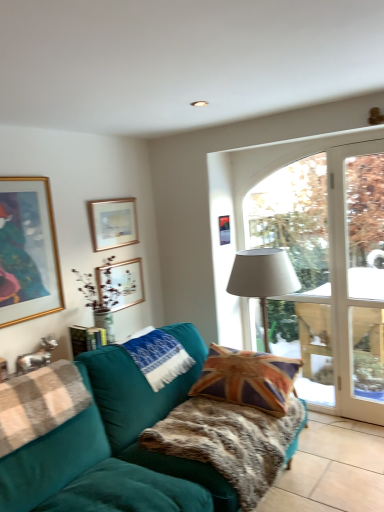
Question: Should I look upward or downward to see matte gold picture frame at upper center, the 3th picture frame positioned from the right?

Choices:
 (A) up
 (B) down

Answer: (A)

Question: Is white fabric lampshade at center thinner than white knitted pillow at center, which appears as the second pillow when viewed from the right?

Choices:
 (A) yes
 (B) no

Answer: (B)

Question: Is white fabric lampshade at center not near white knitted pillow at center, which appears as the second pillow when viewed from the right?

Choices:
 (A) no
 (B) yes

Answer: (A)

Question: From the image's perspective, would you say white fabric lampshade at center is positioned over white knitted pillow at center, which appears as the second pillow when viewed from the right?

Choices:
 (A) no
 (B) yes

Answer: (B)

Question: Does white fabric lampshade at center turn towards white knitted pillow at center, which appears as the second pillow when viewed from the right?

Choices:
 (A) yes
 (B) no

Answer: (B)

Question: Is white fabric lampshade at center next to white knitted pillow at center, which appears as the second pillow when viewed from the right?

Choices:
 (A) no
 (B) yes

Answer: (A)

Question: Is white fabric lampshade at center at the right side of white knitted pillow at center, which appears as the first pillow when viewed from the left?

Choices:
 (A) no
 (B) yes

Answer: (B)

Question: Considering the relative sizes of metallic gold picture frame at upper center, placed as the 1th picture frame when sorted from right to left, and white glass door at right in the image provided, is metallic gold picture frame at upper center, placed as the 1th picture frame when sorted from right to left, bigger than white glass door at right?

Choices:
 (A) no
 (B) yes

Answer: (A)

Question: Is metallic gold picture frame at upper center, acting as the 4th picture frame starting from the left, facing away from white glass door at right?

Choices:
 (A) no
 (B) yes

Answer: (A)

Question: Is metallic gold picture frame at upper center, acting as the 4th picture frame starting from the left, not close to white glass door at right?

Choices:
 (A) yes
 (B) no

Answer: (A)

Question: From a real-world perspective, is metallic gold picture frame at upper center, acting as the 4th picture frame starting from the left, over white glass door at right?

Choices:
 (A) yes
 (B) no

Answer: (A)

Question: Can we say metallic gold picture frame at upper center, acting as the 4th picture frame starting from the left, lies outside white glass door at right?

Choices:
 (A) no
 (B) yes

Answer: (B)

Question: Considering the relative sizes of metallic gold picture frame at upper center, acting as the 4th picture frame starting from the left, and white glass door at right in the image provided, is metallic gold picture frame at upper center, acting as the 4th picture frame starting from the left, smaller than white glass door at right?

Choices:
 (A) yes
 (B) no

Answer: (A)

Question: Would you say white glass door at right is outside white knitted pillow at center, which appears as the first pillow when viewed from the left?

Choices:
 (A) yes
 (B) no

Answer: (A)